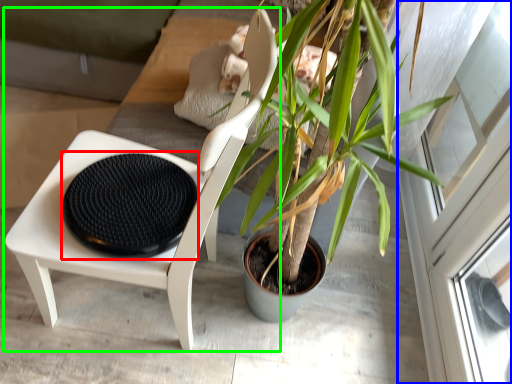
Question: Estimate the real-world distances between objects in this image. Which object is closer to footrest (highlighted by a red box), screen door (highlighted by a blue box) or chair (highlighted by a green box)?

Choices:
 (A) screen door
 (B) chair

Answer: (B)